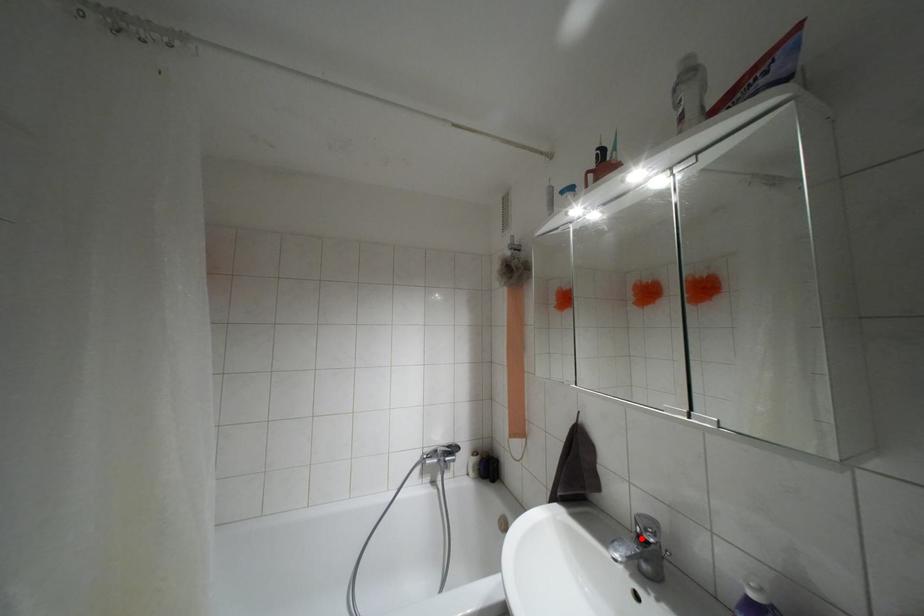
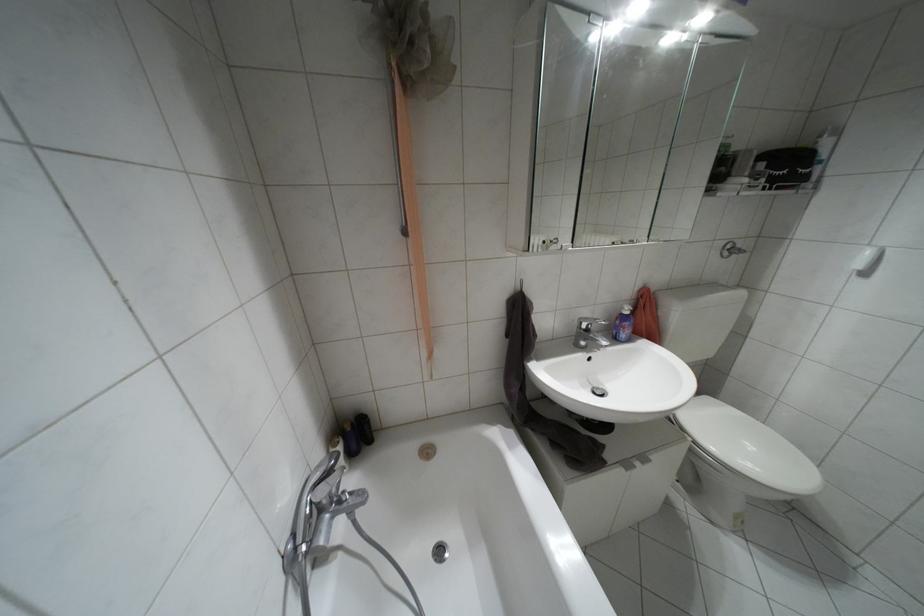
Locate, in the second image, the point that corresponds to the highlighted location in the first image.

(587, 330)